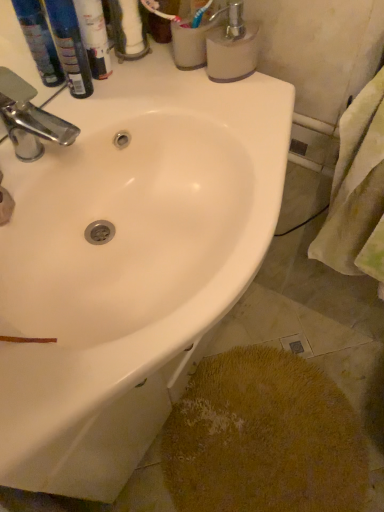
Question: Should I look upward or downward to see white matte toilet paper at upper center?

Choices:
 (A) up
 (B) down

Answer: (A)

Question: Does blue plastic bottles at upper left, marked as the first toiletry in a left-to-right arrangement, have a smaller size compared to yellow fabric towel at right?

Choices:
 (A) no
 (B) yes

Answer: (B)

Question: From a real-world perspective, is blue plastic bottles at upper left, marked as the first toiletry in a left-to-right arrangement, beneath yellow fabric towel at right?

Choices:
 (A) no
 (B) yes

Answer: (A)

Question: Does blue plastic bottles at upper left, marked as the first toiletry in a left-to-right arrangement, have a lesser height compared to yellow fabric towel at right?

Choices:
 (A) yes
 (B) no

Answer: (A)

Question: Are blue plastic bottles at upper left, which is the 2th toiletry in right-to-left order, and yellow fabric towel at right located far from each other?

Choices:
 (A) yes
 (B) no

Answer: (B)

Question: Is blue plastic bottles at upper left, which is the 2th toiletry in right-to-left order, turned away from yellow fabric towel at right?

Choices:
 (A) yes
 (B) no

Answer: (B)

Question: Can you see blue plastic bottles at upper left, marked as the first toiletry in a left-to-right arrangement, touching yellow fabric towel at right?

Choices:
 (A) no
 (B) yes

Answer: (A)

Question: Is white matte soap dispenser at upper right not inside white glossy sink at upper center?

Choices:
 (A) yes
 (B) no

Answer: (A)

Question: From a real-world perspective, is white matte soap dispenser at upper right physically above white glossy sink at upper center?

Choices:
 (A) no
 (B) yes

Answer: (B)

Question: Can you confirm if white matte soap dispenser at upper right is wider than white glossy sink at upper center?

Choices:
 (A) yes
 (B) no

Answer: (B)

Question: Is white matte soap dispenser at upper right thinner than white glossy sink at upper center?

Choices:
 (A) yes
 (B) no

Answer: (A)

Question: Does white matte soap dispenser at upper right have a greater height compared to white glossy sink at upper center?

Choices:
 (A) yes
 (B) no

Answer: (B)

Question: Can you confirm if white matte soap dispenser at upper right is positioned to the left of white glossy sink at upper center?

Choices:
 (A) no
 (B) yes

Answer: (A)

Question: Considering the relative sizes of yellow textured rug at lower right and chrome metallic faucet at upper left in the image provided, is yellow textured rug at lower right taller than chrome metallic faucet at upper left?

Choices:
 (A) yes
 (B) no

Answer: (B)